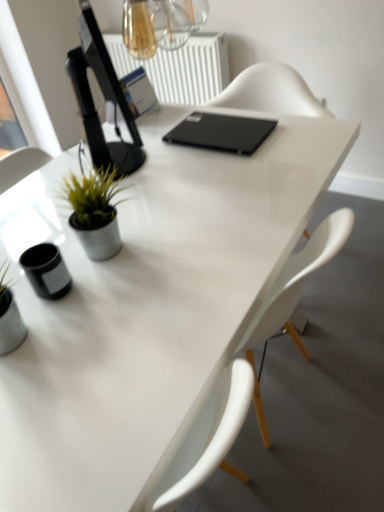
The width and height of the screenshot is (384, 512). Identify the location of free space between black matte laptop at center and black glossy computer monitor at upper left. (173, 154).